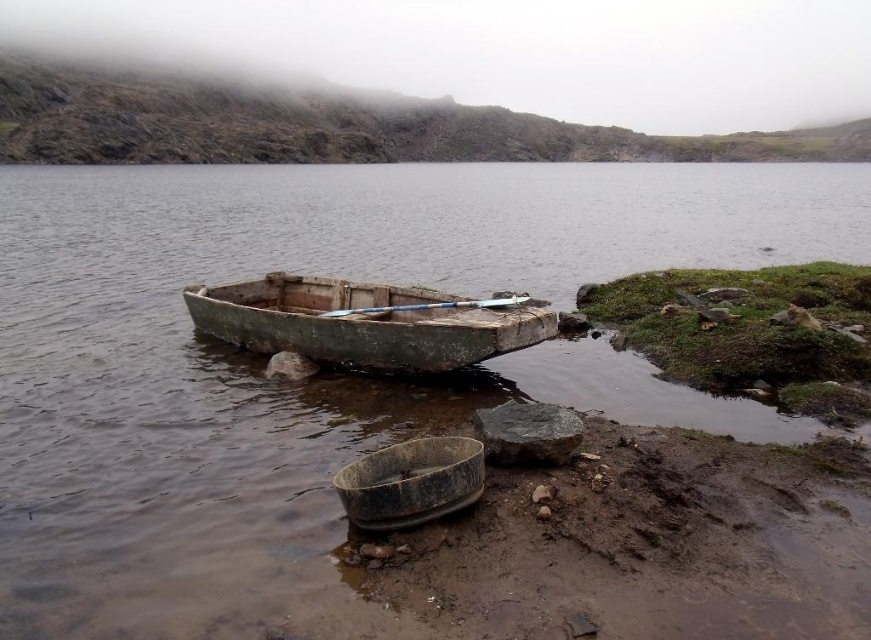
You are standing on the muddy wet soil at lower right and want to reach the brown matte water at center. Which direction should you move to get there?

You should move to the right because the brown matte water at center is to the left of muddy wet soil at lower right, so moving right from the soil will lead you towards the water.

You are standing at the point labeled as point (640, 547). You want to walk towards the rustic wooden boat resting on the shore. Which direction should you move in to reach the boat?

The muddy wet soil at lower right is represented by point (640, 547). Since the boat is resting on the shore, you should move towards the shore from the point (640, 547) to reach the boat.